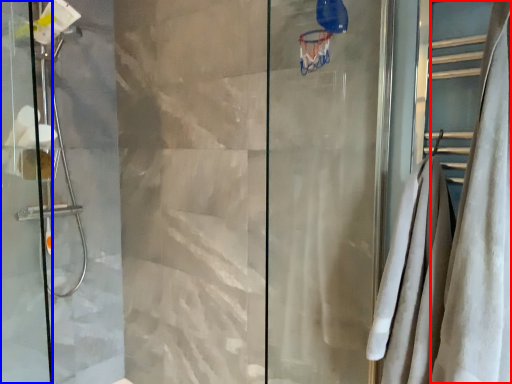
Question: Which object appears farthest to the camera in this image, shower curtain (highlighted by a red box) or screen door (highlighted by a blue box)?

Choices:
 (A) shower curtain
 (B) screen door

Answer: (B)